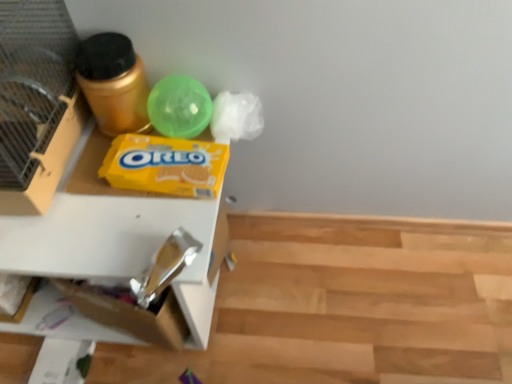
The height and width of the screenshot is (384, 512). I want to click on vacant area in front of gold metallic canister at upper left, so click(108, 208).